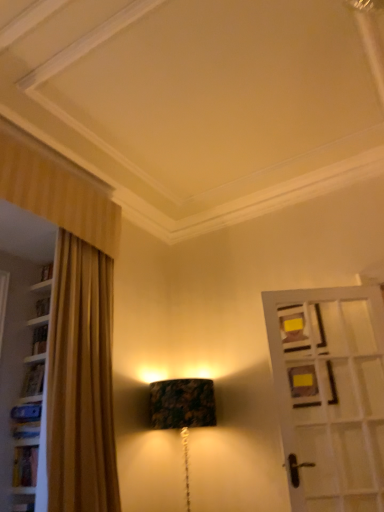
Question: Is marble-patterned lampshade at center closer to camera compared to white wooden door at right?

Choices:
 (A) yes
 (B) no

Answer: (B)

Question: Is marble-patterned lampshade at center in contact with white wooden door at right?

Choices:
 (A) yes
 (B) no

Answer: (B)

Question: From a real-world perspective, does marble-patterned lampshade at center stand above white wooden door at right?

Choices:
 (A) no
 (B) yes

Answer: (A)

Question: From the image's perspective, would you say marble-patterned lampshade at center is shown under white wooden door at right?

Choices:
 (A) no
 (B) yes

Answer: (B)

Question: Considering the relative sizes of marble-patterned lampshade at center and white wooden door at right in the image provided, is marble-patterned lampshade at center smaller than white wooden door at right?

Choices:
 (A) yes
 (B) no

Answer: (B)

Question: From the image's perspective, is marble-patterned lampshade at center located above white wooden door at right?

Choices:
 (A) yes
 (B) no

Answer: (B)

Question: Is white wooden door at right oriented away from marble-patterned lampshade at center?

Choices:
 (A) no
 (B) yes

Answer: (A)

Question: Is white wooden door at right far away from marble-patterned lampshade at center?

Choices:
 (A) yes
 (B) no

Answer: (B)

Question: Is the position of white wooden door at right less distant than that of marble-patterned lampshade at center?

Choices:
 (A) no
 (B) yes

Answer: (B)

Question: Is white wooden door at right to the left of marble-patterned lampshade at center from the viewer's perspective?

Choices:
 (A) yes
 (B) no

Answer: (B)

Question: From the image's perspective, is white wooden door at right under marble-patterned lampshade at center?

Choices:
 (A) no
 (B) yes

Answer: (A)

Question: Does white wooden door at right have a lesser height compared to marble-patterned lampshade at center?

Choices:
 (A) no
 (B) yes

Answer: (A)

Question: Is white wooden door at right wider or thinner than marble-patterned lampshade at center?

Choices:
 (A) thin
 (B) wide

Answer: (A)